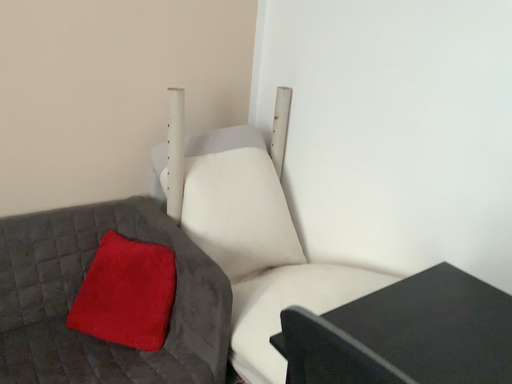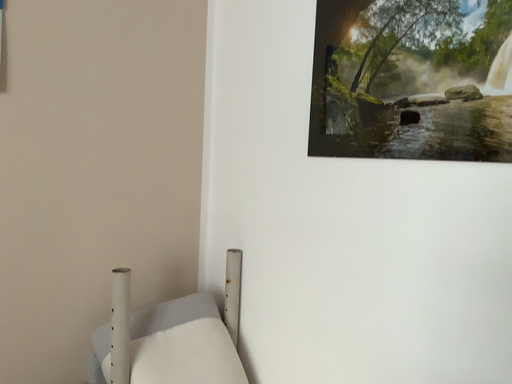
Question: How did the camera likely rotate when shooting the video?

Choices:
 (A) rotated left
 (B) rotated right

Answer: (B)